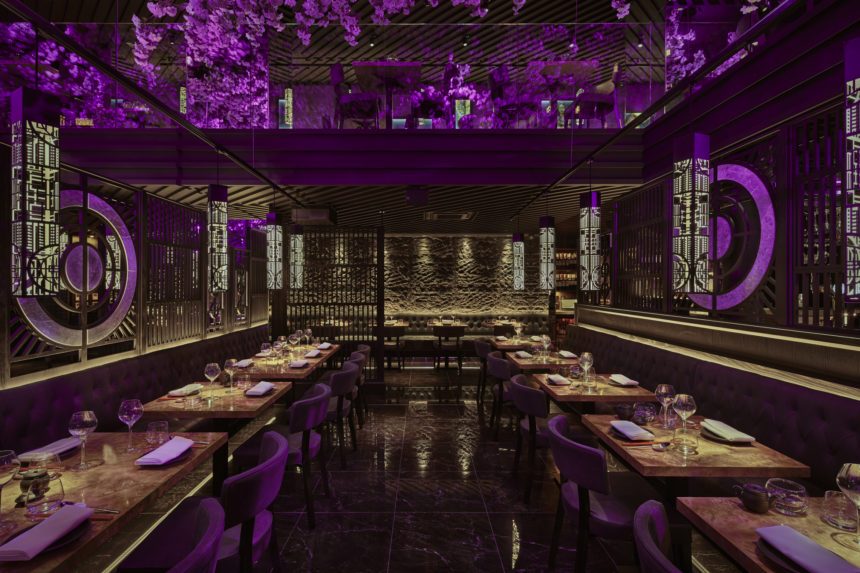
Locate an element on the screen. The width and height of the screenshot is (860, 573). leftmost chair is located at coordinates (197, 536).